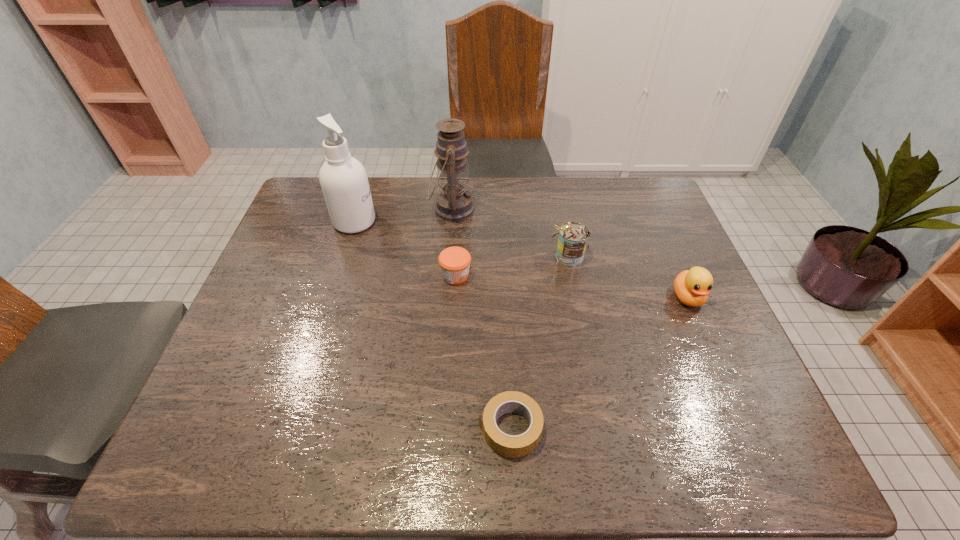
Image resolution: width=960 pixels, height=540 pixels. Find the location of `free space between the fifth object from left to right and the rightmost object`. free space between the fifth object from left to right and the rightmost object is located at coordinates (628, 278).

I want to click on empty space that is in between the oil lamp and the duct tape, so click(481, 319).

Where is `empty space that is in between the third tallest object and the leftmost object`? This screenshot has width=960, height=540. empty space that is in between the third tallest object and the leftmost object is located at coordinates (462, 240).

The image size is (960, 540). Identify the location of vacant area that lies between the fifth object from left to right and the cleansing agent. [x=462, y=240].

I want to click on free point between the jam and the third object from right to left, so click(x=483, y=352).

Locate an element on the screen. The height and width of the screenshot is (540, 960). vacant region between the duckling and the can is located at coordinates (628, 278).

Locate an element on the screen. The height and width of the screenshot is (540, 960). object that is the third closest to the oil lamp is located at coordinates (573, 237).

Locate which object ranks second in proximity to the second shortest object. Please provide its 2D coordinates. Your answer should be formatted as a tuple, i.e. [(x, y)], where the tuple contains the x and y coordinates of a point satisfying the conditions above.

[(573, 237)]

Where is `vacant position in the image that satisfies the following two spatial constraints: 1. on the front label of the leftmost object; 2. on the left side of the can`? vacant position in the image that satisfies the following two spatial constraints: 1. on the front label of the leftmost object; 2. on the left side of the can is located at coordinates (343, 258).